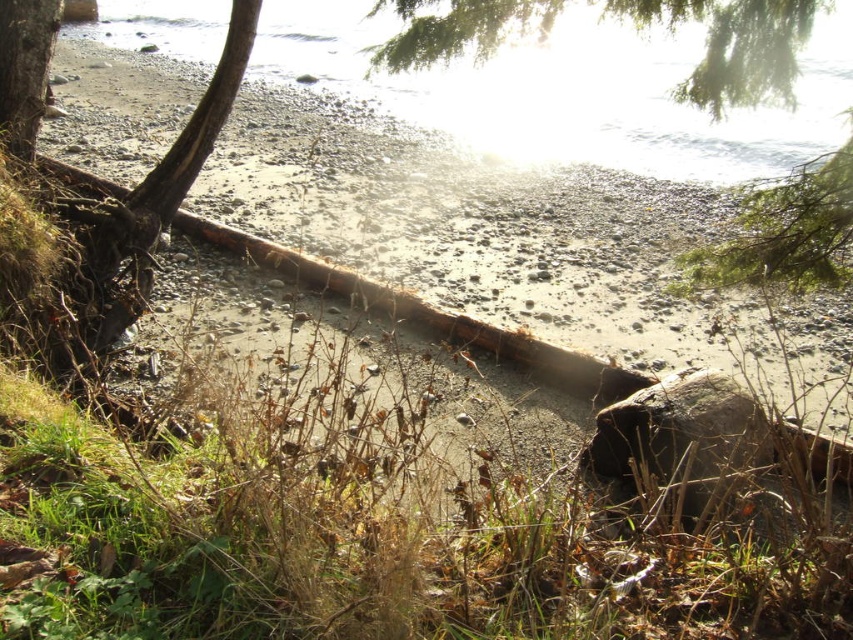
Does clear water at upper center appear on the left side of green leafy tree at upper center?

Indeed, clear water at upper center is positioned on the left side of green leafy tree at upper center.

Which of these two, clear water at upper center or green leafy tree at upper center, stands taller?

clear water at upper center

Is point (839, 118) positioned behind point (775, 38)?

Yes, it is behind point (775, 38).

At what (x,y) coordinates should I click in order to perform the action: click on clear water at upper center. Please return your answer as a coordinate pair (x, y). Looking at the image, I should click on (573, 92).

Based on the photo, is green leafy tree at upper center to the right of smooth bark tree trunk at left from the viewer's perspective?

Indeed, green leafy tree at upper center is positioned on the right side of smooth bark tree trunk at left.

Between green leafy tree at upper center and smooth bark tree trunk at left, which one is positioned higher?

smooth bark tree trunk at left is higher up.

Where is `green leafy tree at upper center`? The image size is (853, 640). green leafy tree at upper center is located at coordinates (636, 29).

Where is `green leafy tree at upper center`? This screenshot has width=853, height=640. green leafy tree at upper center is located at coordinates (636, 29).

Can you confirm if clear water at upper center is smaller than smooth bark tree trunk at left?

Incorrect, clear water at upper center is not smaller in size than smooth bark tree trunk at left.

This screenshot has height=640, width=853. Identify the location of clear water at upper center. (573, 92).

What do you see at coordinates (573, 92) in the screenshot? I see `clear water at upper center` at bounding box center [573, 92].

The image size is (853, 640). Identify the location of clear water at upper center. (573, 92).